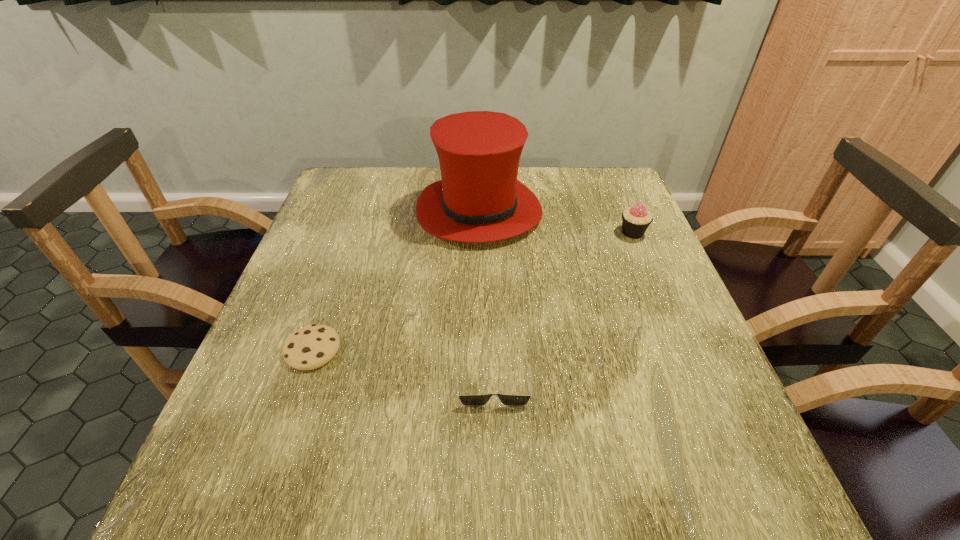
This screenshot has height=540, width=960. In order to click on free spot that satisfies the following two spatial constraints: 1. on the back side of the leftmost object; 2. on the left side of the second tallest object in this screenshot , I will do `click(353, 233)`.

The image size is (960, 540). What are the coordinates of `vacant space that satisfies the following two spatial constraints: 1. on the front side of the tallest object; 2. on the left side of the second tallest object` in the screenshot? It's located at (479, 233).

Where is `vacant area that satisfies the following two spatial constraints: 1. on the front side of the hat; 2. on the right side of the cupcake`? This screenshot has width=960, height=540. vacant area that satisfies the following two spatial constraints: 1. on the front side of the hat; 2. on the right side of the cupcake is located at coordinates (479, 233).